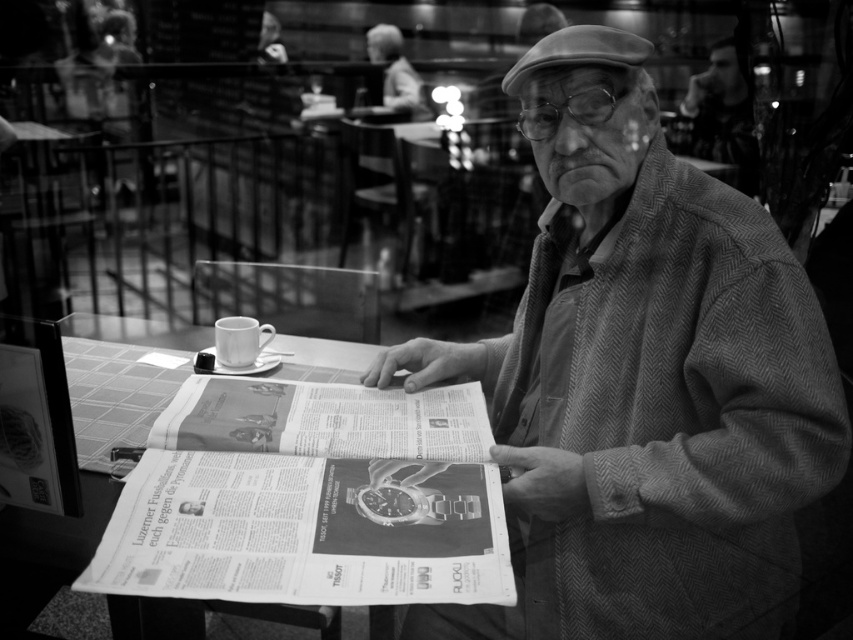
Who is positioned more to the left, herringbone wool coat at center or paper at center?

Positioned to the left is paper at center.

Can you confirm if herringbone wool coat at center is positioned below paper at center?

No.

Who is more forward, (665, 352) or (352, 636)?

Point (665, 352) is more forward.

The image size is (853, 640). I want to click on herringbone wool coat at center, so click(641, 380).